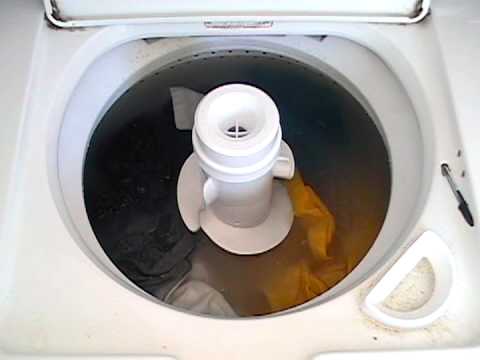
Locate an element on the screen. The width and height of the screenshot is (480, 360). dirtied water in washer is located at coordinates (259, 266), (331, 168), (171, 174), (247, 304), (200, 244), (341, 236), (383, 193).